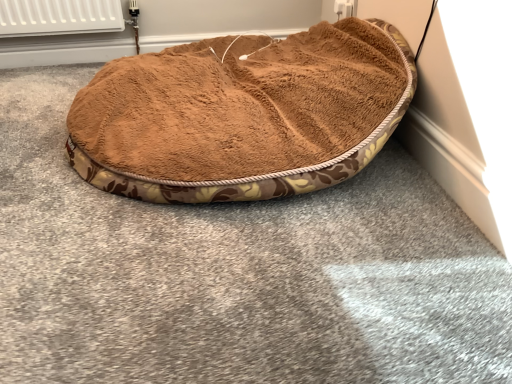
What is the approximate width of brown plush dog bed at center?

33.84 inches.

Where is `brown plush dog bed at center`? This screenshot has width=512, height=384. brown plush dog bed at center is located at coordinates (256, 176).

The height and width of the screenshot is (384, 512). What do you see at coordinates (256, 176) in the screenshot? I see `brown plush dog bed at center` at bounding box center [256, 176].

Identify the location of brown plush dog bed at center. The height and width of the screenshot is (384, 512). 256,176.